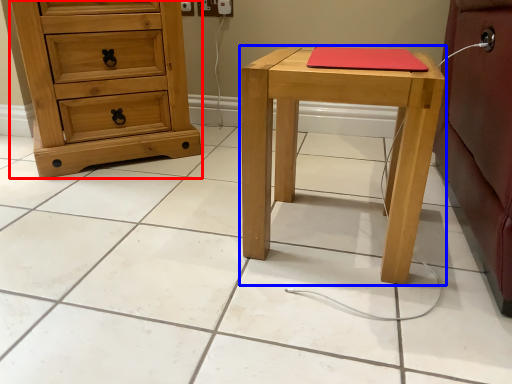
Question: Which object appears closest to the camera in this image, chest of drawers (highlighted by a red box) or stool (highlighted by a blue box)?

Choices:
 (A) chest of drawers
 (B) stool

Answer: (B)